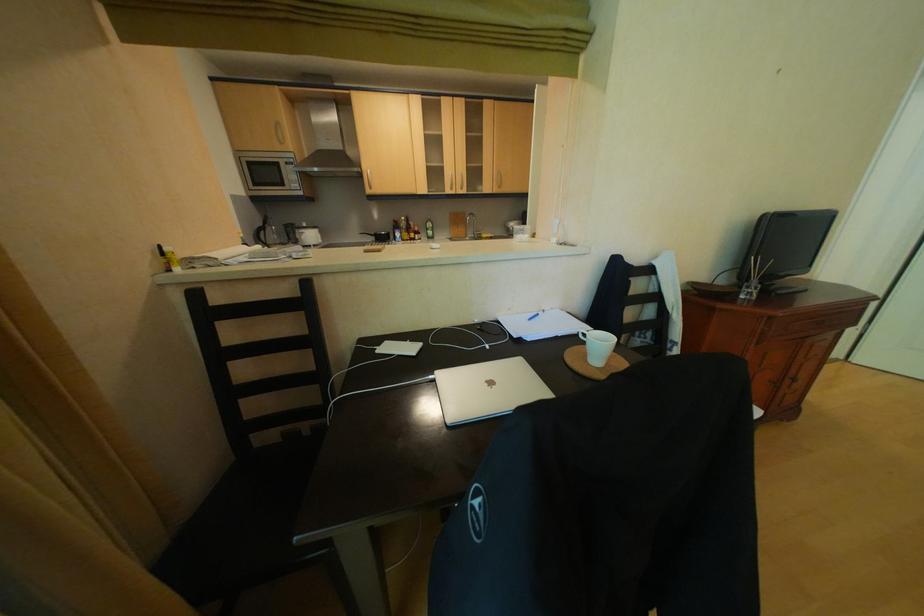
What are the coordinates of `white power bank` in the screenshot? It's located at (273, 176).